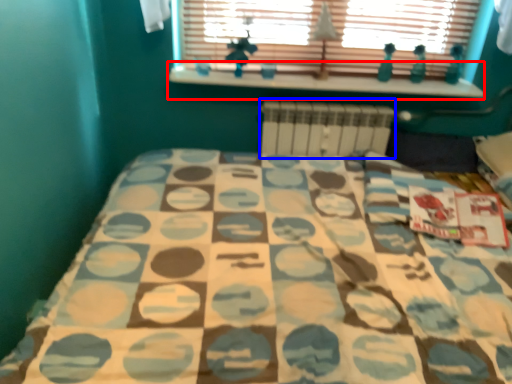
Question: Which object appears closest to the camera in this image, window sill (highlighted by a red box) or radiator (highlighted by a blue box)?

Choices:
 (A) window sill
 (B) radiator

Answer: (A)